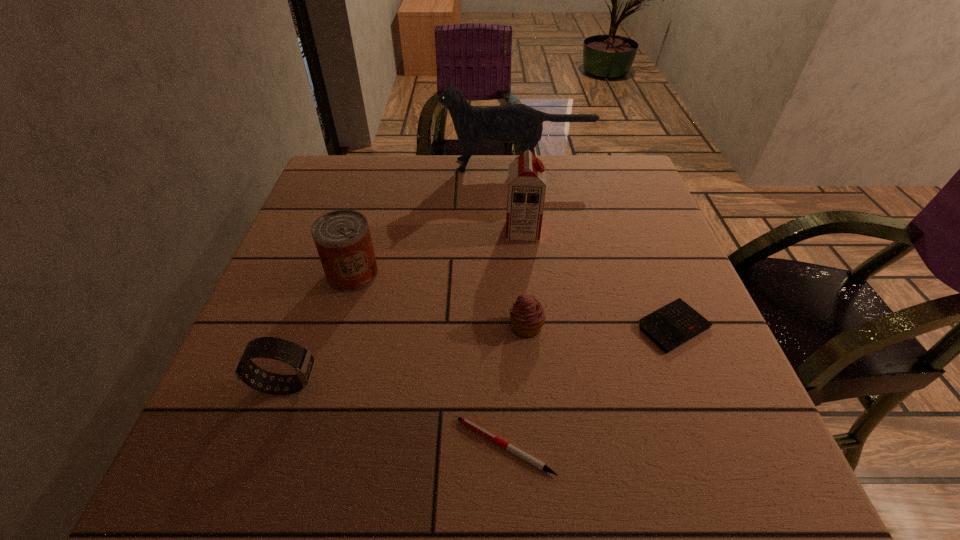
Identify the location of free region at the right edge of the desktop. This screenshot has height=540, width=960. (727, 411).

This screenshot has height=540, width=960. I want to click on free space at the far left corner of the desktop, so click(369, 161).

You are a GUI agent. You are given a task and a screenshot of the screen. Output one action in this format:
    pyautogui.click(x=<x>, y=<y>)
    Task: Click on the free space at the near left corner
    
    Given the screenshot: What is the action you would take?
    pyautogui.click(x=213, y=489)

This screenshot has height=540, width=960. What are the coordinates of `vacant space at the far right corner` in the screenshot? It's located at (623, 157).

Where is `vacant space at the near right corner`? The image size is (960, 540). vacant space at the near right corner is located at coordinates (668, 465).

Find the location of `vacant region between the cat and the fourth tallest object`. vacant region between the cat and the fourth tallest object is located at coordinates pyautogui.click(x=401, y=275).

Where is `free space between the third tallest object and the cat`? This screenshot has height=540, width=960. free space between the third tallest object and the cat is located at coordinates (435, 220).

Identify the location of empty space between the fifth shortest object and the second farthest object. (438, 253).

Identify the location of free space between the cat and the fifth shortest object. (435, 220).

The image size is (960, 540). In order to click on blank region between the sixth farthest object and the soya milk in this screenshot , I will do click(x=404, y=308).